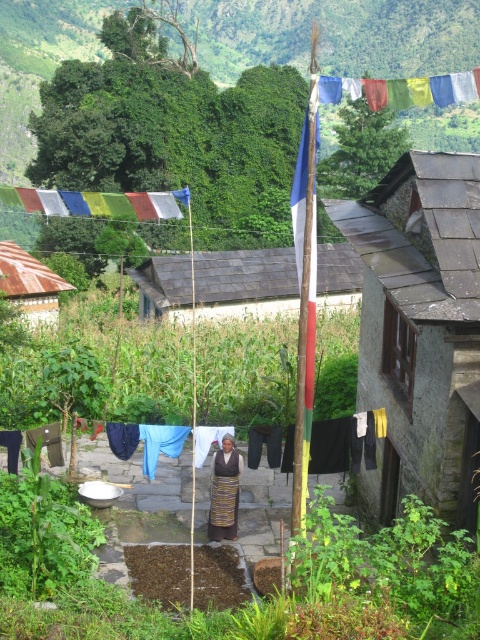
Which of these two, white painted wood hut at center or multicolored fabric at upper center, stands taller?

multicolored fabric at upper center is taller.

Does point (294, 300) come in front of point (334, 97)?

No, (294, 300) is behind (334, 97).

Where is `white painted wood hut at center`? white painted wood hut at center is located at coordinates tap(245, 284).

Is blue fabric at center thinner than multicolored fabric at upper center?

Yes.

Who is higher up, blue fabric at center or multicolored fabric at upper center?

multicolored fabric at upper center is above.

Locate an element on the screen. The image size is (480, 640). blue fabric at center is located at coordinates (344, 440).

At what (x,y) coordinates should I click in order to perform the action: click on blue fabric at center. Please return your answer as a coordinate pair (x, y). Looking at the image, I should click on (344, 440).

Does white painted wood hut at center have a greater height compared to rusty metal hut at left?

Indeed, white painted wood hut at center has a greater height compared to rusty metal hut at left.

Which is behind, point (168, 276) or point (44, 284)?

Point (44, 284)

You are a GUI agent. You are given a task and a screenshot of the screen. Output one action in this format:
    pyautogui.click(x=<x>, y=<y>)
    Task: Click on the white painted wood hut at center
    Image resolution: width=480 pixels, height=640 pixels.
    Given the screenshot: What is the action you would take?
    pyautogui.click(x=245, y=284)